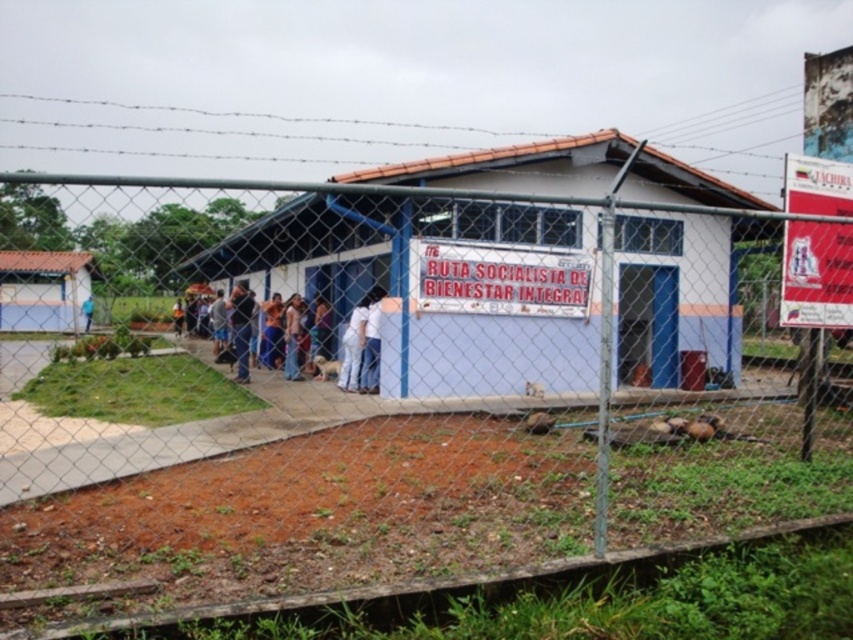
You are a photographer taking a picture of the white painted wood hut at center and the blue fabric shirt at left. Which object should you focus on first if you want to capture both clearly in the same frame?

The white painted wood hut at center is larger in size than the blue fabric shirt at left, so you should focus on the white painted wood hut at center first to ensure both are in focus.

You are a visitor arriving at the scene and need to locate the building. Which object is taller between the white painted wood hut at center and the blue fabric shirt at left?

The white painted wood hut at center is taller than the blue fabric shirt at left according to the description.

You are standing at the point closest to the building. Which point is closer to you, point (x=630, y=144) or point (x=294, y=308)?

Point (x=630, y=144) is in front of point (x=294, y=308), so if you are standing at the point closest to the building, point (x=630, y=144) is closer to you.